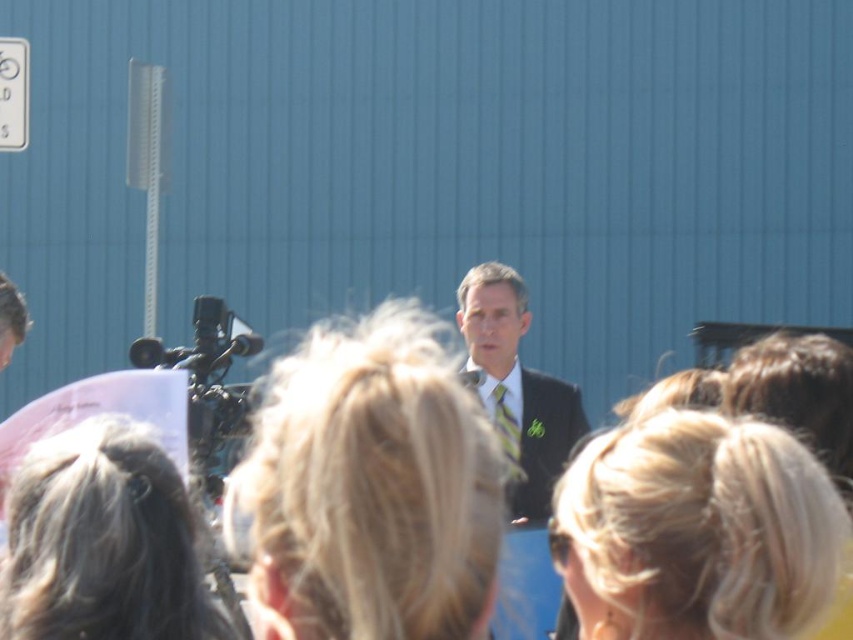
Is point (532, 435) less distant than point (21, 140)?

Yes.

Can you confirm if dark suit at center is positioned to the left of metallic rectangular at upper left?

No, dark suit at center is not to the left of metallic rectangular at upper left.

Between point (553, 404) and point (15, 90), which one is positioned in front?

Point (553, 404)

I want to click on dark suit at center, so click(517, 387).

Which is more to the right, metallic rectangular at upper left or green striped tie at center?

From the viewer's perspective, green striped tie at center appears more on the right side.

Identify the location of metallic rectangular at upper left. The image size is (853, 640). (13, 93).

Can you confirm if dark suit at center is positioned to the left of green striped tie at center?

Incorrect, dark suit at center is not on the left side of green striped tie at center.

Find the location of `dark suit at center`. dark suit at center is located at coordinates (517, 387).